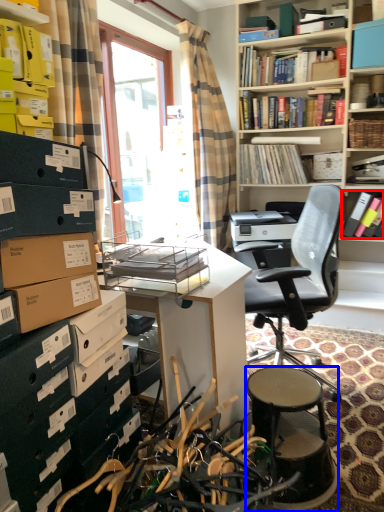
Question: Which of the following is the farthest to the observer, book (highlighted by a red box) or stool (highlighted by a blue box)?

Choices:
 (A) book
 (B) stool

Answer: (A)